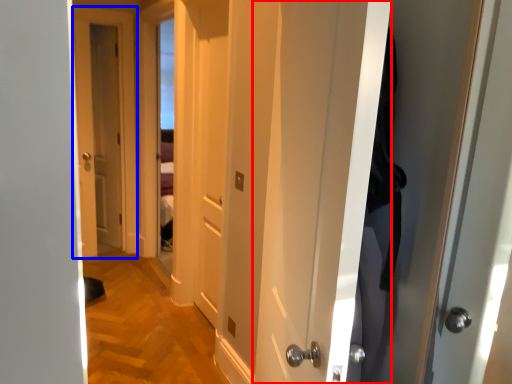
Question: Which of the following is the closest to the observer, door (highlighted by a red box) or door (highlighted by a blue box)?

Choices:
 (A) door
 (B) door

Answer: (A)